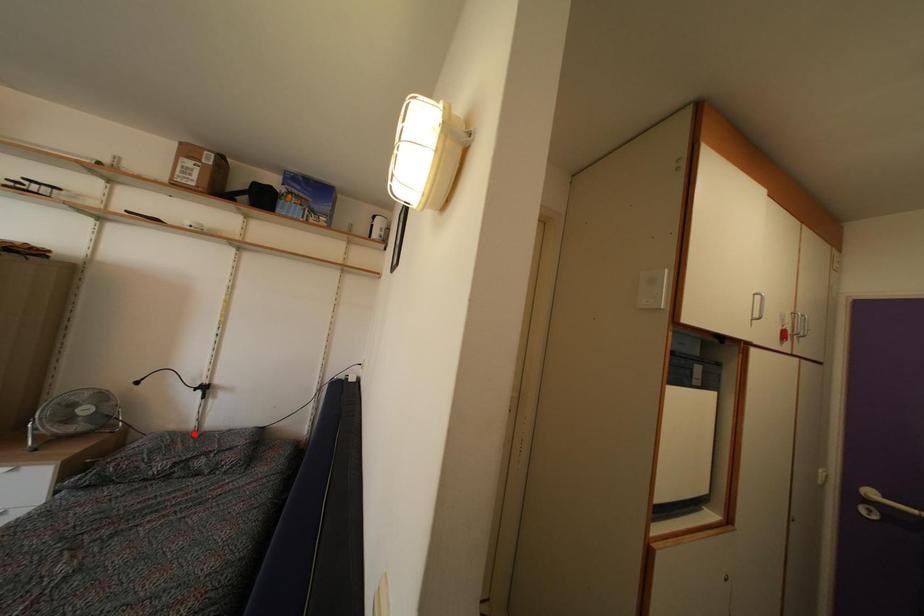
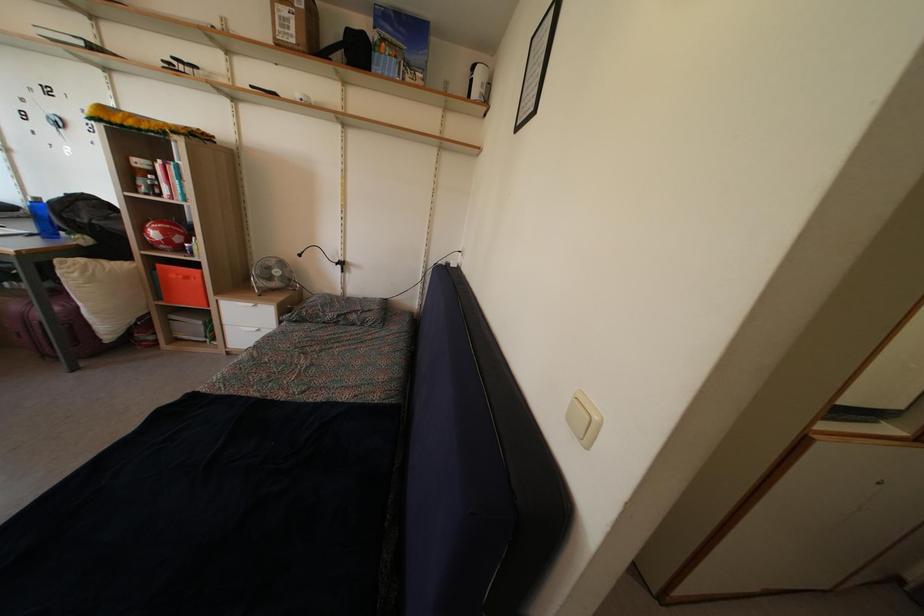
Question: I am providing you with two images of the same scene from different viewpoints. A red point is marked on the first image. Can you still see the location of the red point in image 2?

Choices:
 (A) Yes
 (B) No

Answer: (A)